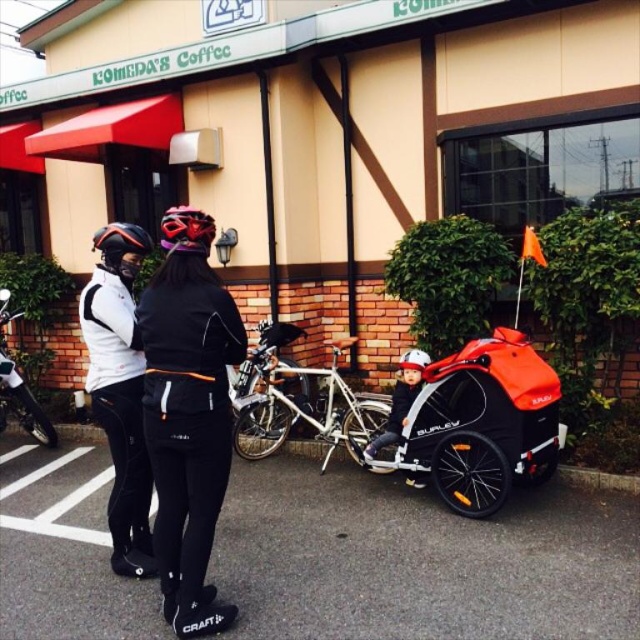
Which of these two, white matte jacket at center or shiny silver bicycle at center, stands shorter?

Standing shorter between the two is shiny silver bicycle at center.

Which of these two, white matte jacket at center or shiny silver bicycle at center, stands taller?

white matte jacket at center is taller.

The image size is (640, 640). What do you see at coordinates (120, 388) in the screenshot?
I see `white matte jacket at center` at bounding box center [120, 388].

The height and width of the screenshot is (640, 640). I want to click on white matte jacket at center, so click(x=120, y=388).

Does black matte jacket at center have a smaller size compared to matte black helmet at upper left?

No, black matte jacket at center is not smaller than matte black helmet at upper left.

Is the position of black matte jacket at center more distant than that of matte black helmet at upper left?

No.

Locate an element on the screen. black matte jacket at center is located at coordinates (188, 413).

Which is more to the left, matte black helmet at upper left or shiny red helmet at center?

matte black helmet at upper left

Is matte black helmet at upper left below shiny red helmet at center?

Yes.

Between point (141, 253) and point (204, 212), which one is positioned behind?

The point (204, 212) is behind.

You are a GUI agent. You are given a task and a screenshot of the screen. Output one action in this format:
    pyautogui.click(x=<x>, y=<y>)
    Task: Click on the matte black helmet at upper left
    The image size is (640, 640).
    Given the screenshot: What is the action you would take?
    pyautogui.click(x=122, y=248)